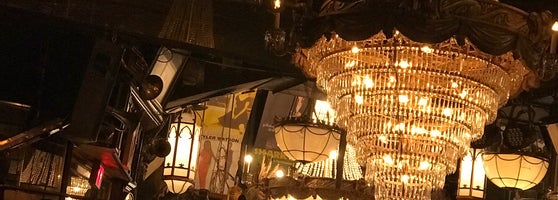
I want to click on arm of chandelier, so click(285, 53), click(276, 50), click(276, 36).